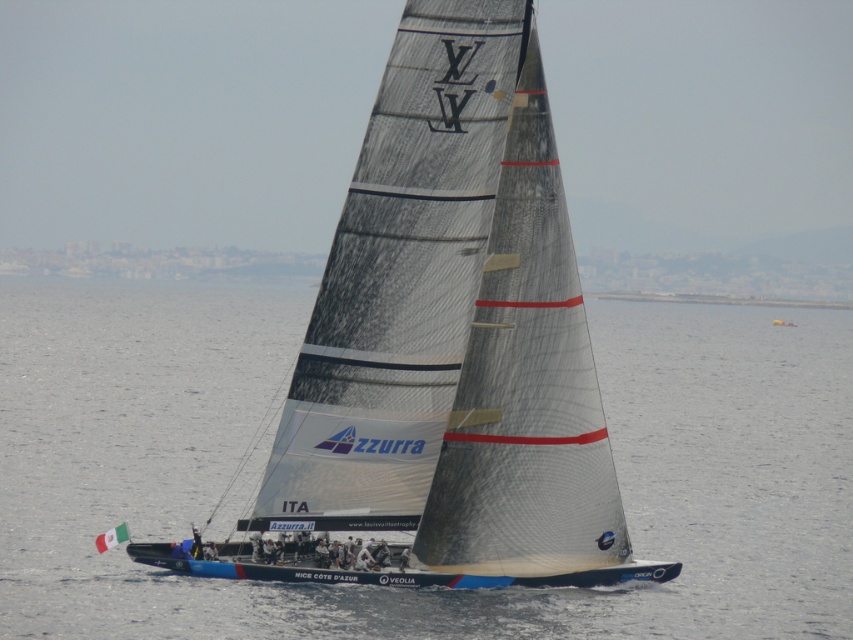
Who is more forward, (718, 550) or (514, 202)?

Point (514, 202) is in front.

Is transparent water at center above white matte sailboat at center?

Incorrect, transparent water at center is not positioned above white matte sailboat at center.

This screenshot has height=640, width=853. What do you see at coordinates (410, 588) in the screenshot?
I see `transparent water at center` at bounding box center [410, 588].

Locate an element on the screen. This screenshot has height=640, width=853. transparent water at center is located at coordinates (410, 588).